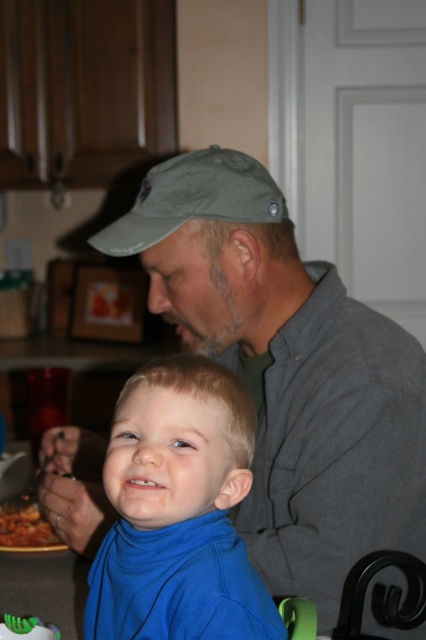
You are standing in the kitchen and want to reach both the point at coordinates (218,182) and the point at (5,540). Which point should you reach for first if you want to touch them in order from closest to farthest?

You should reach for point (218,182) first because it is closer to you than point (5,540).

You are a chef trying to place a new ingredient on the table. The table has limited space. You have an olive green fabric baseball cap at upper center and tomato sauce at lower left. Which object requires more horizontal space on the table?

The olive green fabric baseball cap at upper center requires more horizontal space on the table because its width surpasses that of the tomato sauce at lower left.

Consider the image. You are a delivery person who needs to place a small package between the olive green fabric baseball cap at upper center and the tomato sauce at lower left. The package is 12 inches long. Can you fit it horizontally between them?

The distance between the olive green fabric baseball cap at upper center and the tomato sauce at lower left is 25.61 inches. Since the package is only 12 inches long, it can easily be placed horizontally between them without any issue.